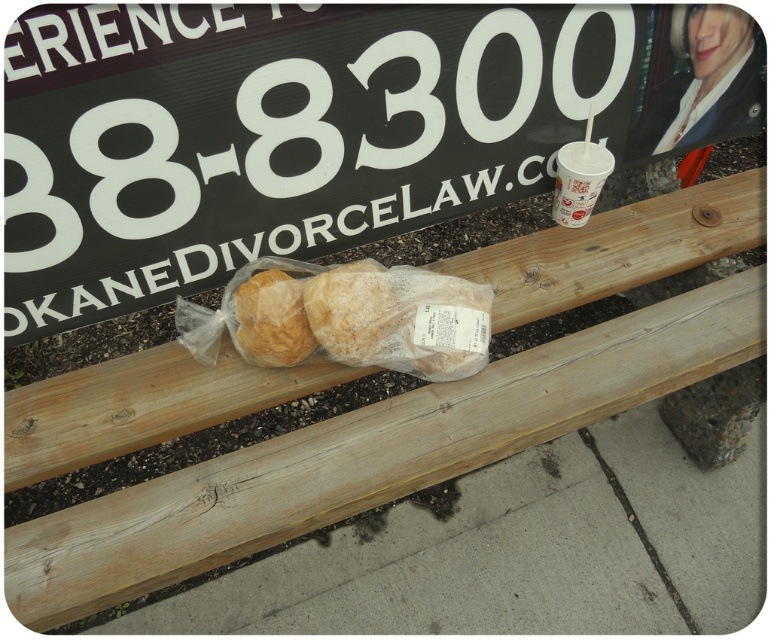
You are a delivery person who needs to pick up an item from a bench. The item is located at coordinates 0.500, 0.354. Where should you look on the bench to find the golden brown bread at center?

The golden brown bread at center is located at the coordinates [271,320] on the bench.

You are a delivery person who needs to pack both the translucent plastic baguette at center and the golden brown bread at center into a box. The box can only fit items that are narrower than 20 cm. Which item might not fit if the baguette is 18 cm wide?

The translucent plastic baguette at center is wider than the golden brown bread at center. Since the baguette is 18 cm wide, the bread must be narrower than 18 cm. Therefore, the baguette might not fit into the box if it exceeds the 20 cm limit, but since it is 18 cm, both items should fit as they are under the 20 cm requirement.

You are standing 5 feet away from the bench and want to grab the translucent plastic baguette at center. Can you reach it without moving closer?

The translucent plastic baguette at center is 3.52 feet away from the viewer. Since you are standing 5 feet away, you cannot reach it without moving closer.